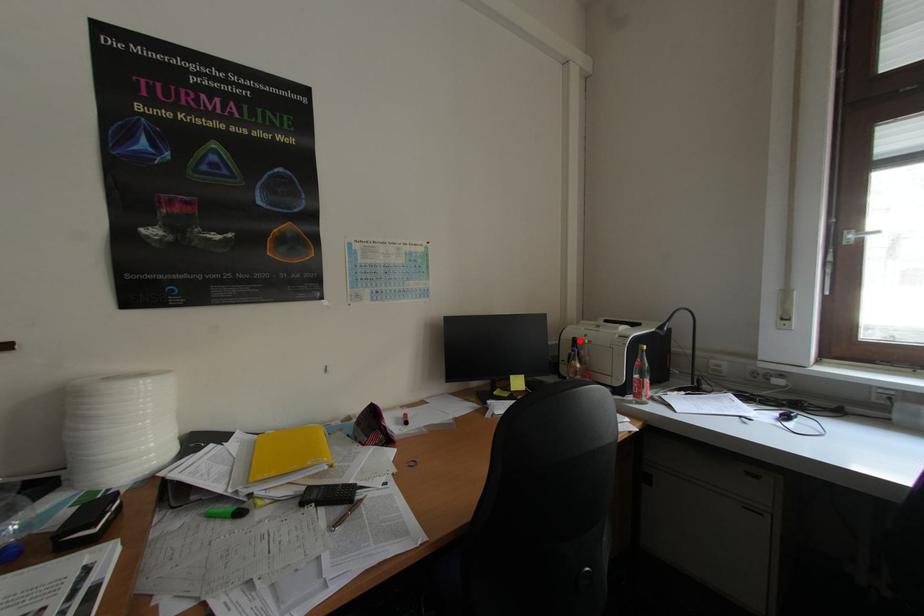
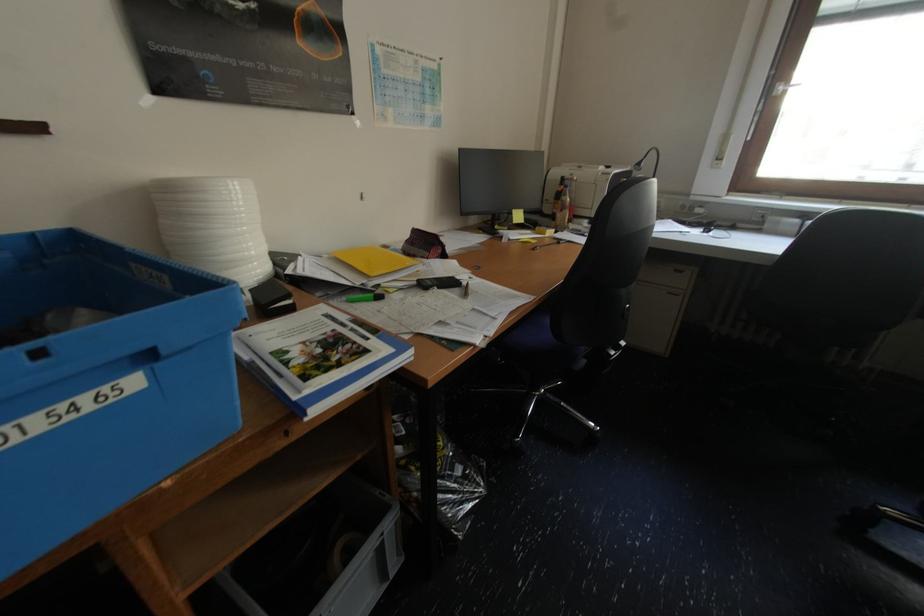
Question: I am providing you with two images of the same scene from different viewpoints. In image1, a red point is highlighted. Considering the same 3D point in image2, which of the following is correct?

Choices:
 (A) It is closer
 (B) It is farther

Answer: (A)